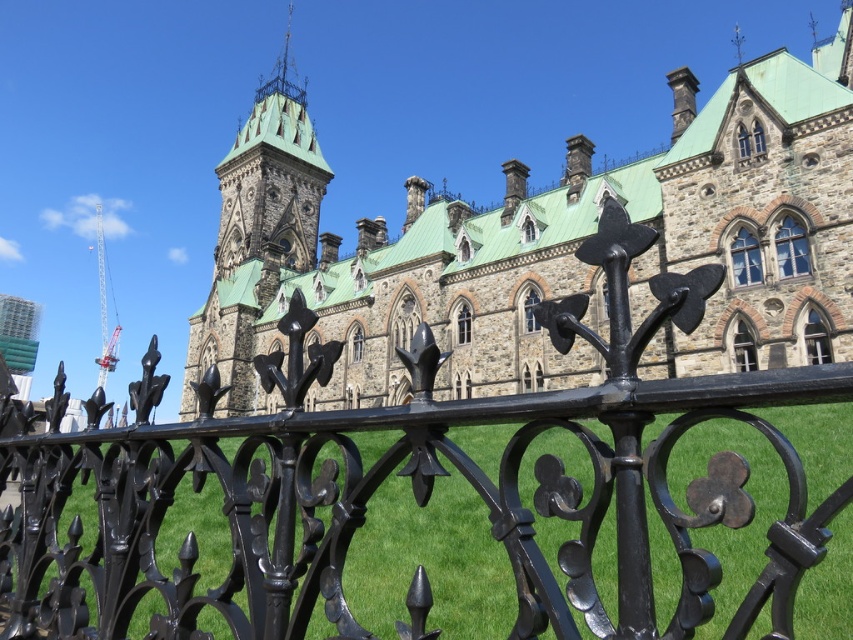
Question: Is stone church at center further to camera compared to green stone tower at upper center?

Choices:
 (A) no
 (B) yes

Answer: (A)

Question: Among these points, which one is farthest from the camera?

Choices:
 (A) coord(323,173)
 (B) coord(521,173)

Answer: (A)

Question: Observing the image, what is the correct spatial positioning of stone church at center in reference to green stone tower at upper center?

Choices:
 (A) above
 (B) below

Answer: (B)

Question: Which object is the closest to the black wrought iron fence at center?

Choices:
 (A) green stone tower at upper center
 (B) stone church at center

Answer: (B)

Question: Which point appears closest to the camera in this image?

Choices:
 (A) (688, 72)
 (B) (567, 392)

Answer: (B)

Question: Can you confirm if black wrought iron fence at center is wider than green stone tower at upper center?

Choices:
 (A) no
 (B) yes

Answer: (B)